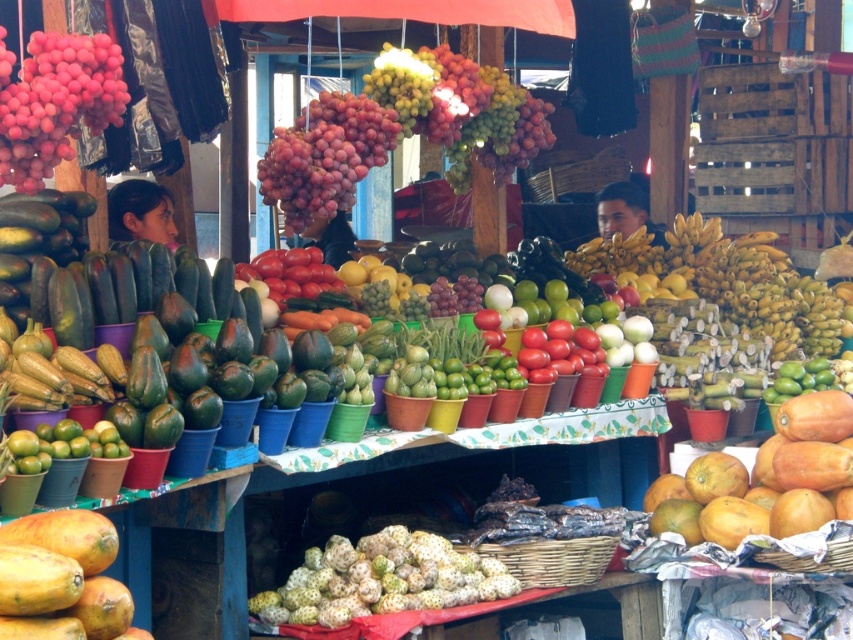
Which of these two, yellow papaya at center or shiny red grapes at upper left, stands taller?

Standing taller between the two is shiny red grapes at upper left.

Does yellow papaya at center have a greater width compared to shiny red grapes at upper left?

Yes.

Who is more forward, (36, 540) or (22, 70)?

Positioned in front is point (36, 540).

Identify the location of yellow papaya at center. The height and width of the screenshot is (640, 853). 62,579.

Can you confirm if yellow papaya at center is thinner than shiny red grapes at center?

Yes, yellow papaya at center is thinner than shiny red grapes at center.

At what (x,y) coordinates should I click in order to perform the action: click on yellow papaya at center. Please return your answer as a coordinate pair (x, y). The width and height of the screenshot is (853, 640). Looking at the image, I should click on (62, 579).

This screenshot has height=640, width=853. Find the location of `yellow papaya at center`. yellow papaya at center is located at coordinates (62, 579).

Who is shorter, green rough durian at center or yellow papaya at center?

With less height is green rough durian at center.

Is point (335, 618) less distant than point (88, 522)?

No, it is behind (88, 522).

Is point (325, 580) positioned behind point (33, 627)?

Yes, point (325, 580) is behind point (33, 627).

The height and width of the screenshot is (640, 853). I want to click on green rough durian at center, so click(381, 579).